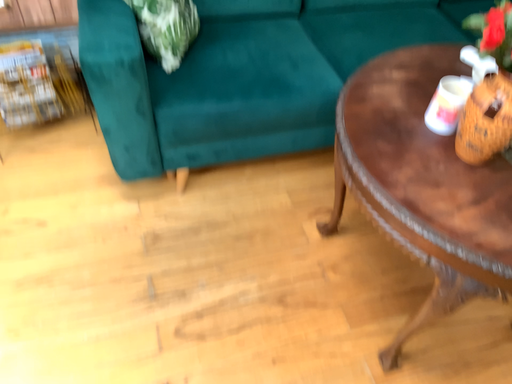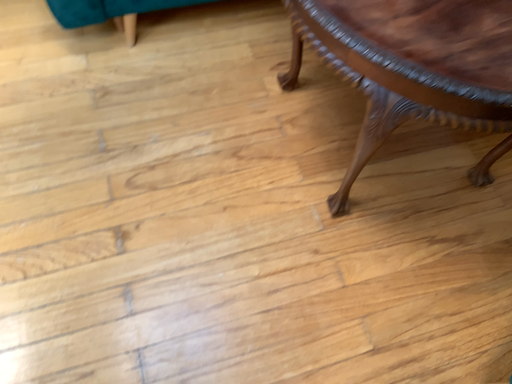
Question: Which way did the camera rotate in the video?

Choices:
 (A) rotated downward
 (B) rotated upward

Answer: (A)